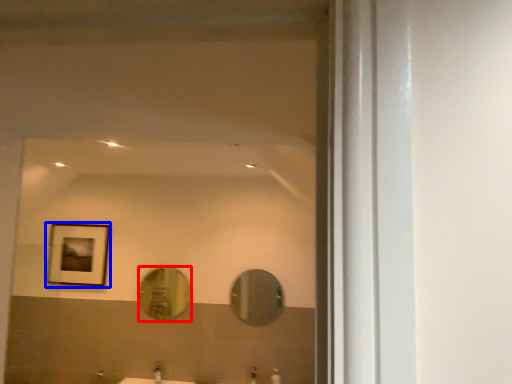
Question: Among these objects, which one is nearest to the camera, mirror (highlighted by a red box) or picture frame (highlighted by a blue box)?

Choices:
 (A) mirror
 (B) picture frame

Answer: (A)